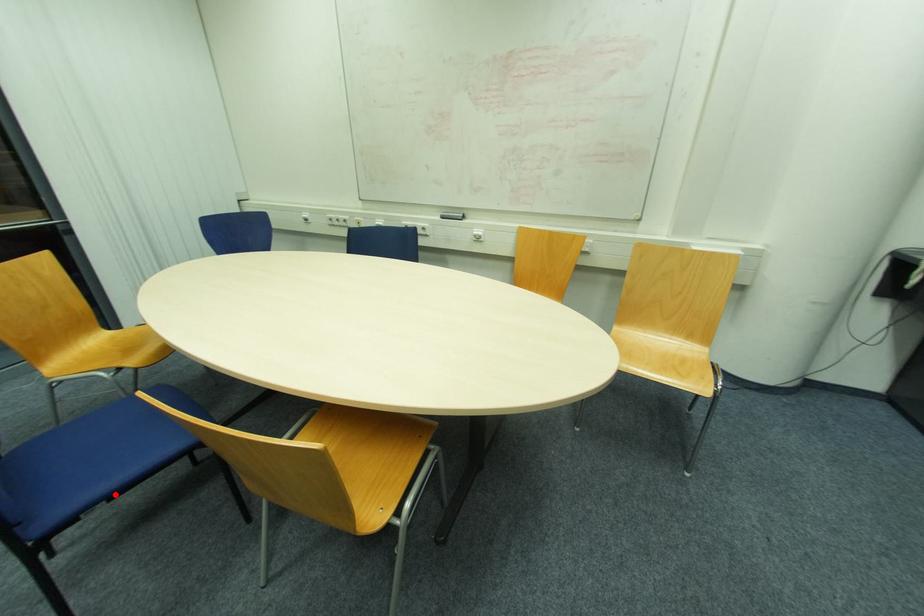
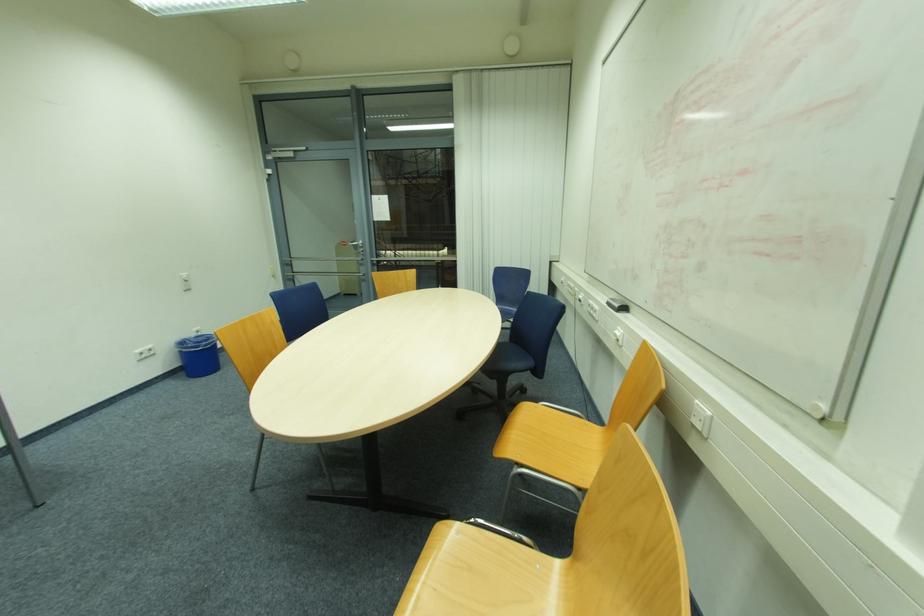
Question: I am providing you with two images of the same scene from different viewpoints. A red point is marked on the first image. At the location where the point appears in image 1, is it still visible in image 2?

Choices:
 (A) Yes
 (B) No

Answer: (B)